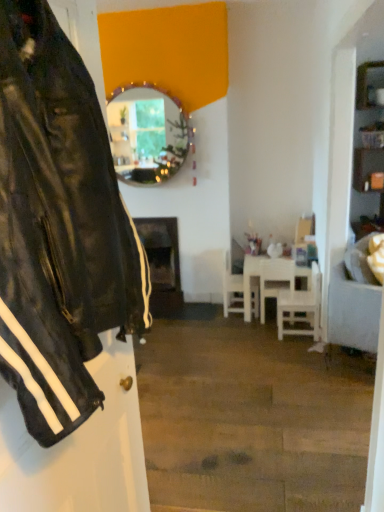
Question: Considering the positions of wooden shelves at right and white matte table at center in the image, is wooden shelves at right bigger or smaller than white matte table at center?

Choices:
 (A) small
 (B) big

Answer: (A)

Question: From a real-world perspective, is wooden shelves at right above or below white matte table at center?

Choices:
 (A) below
 (B) above

Answer: (B)

Question: Estimate the real-world distances between objects in this image. Which object is farther from the white matte chair at center, the 3th chair positioned from the left?

Choices:
 (A) white matte table at center
 (B) black matte fireplace at center
 (C) wooden-framed mirror at upper center
 (D) white glossy chair at center, which is the 2th chair from left to right
 (E) white fabric couch at right

Answer: (C)

Question: Considering the real-world distances, which object is closest to the white matte chair at center, the third chair viewed from the right?

Choices:
 (A) wooden shelves at right
 (B) white matte table at center
 (C) white glossy chair at center, the second chair when ordered from right to left
 (D) black matte fireplace at center
 (E) white fabric couch at right

Answer: (B)